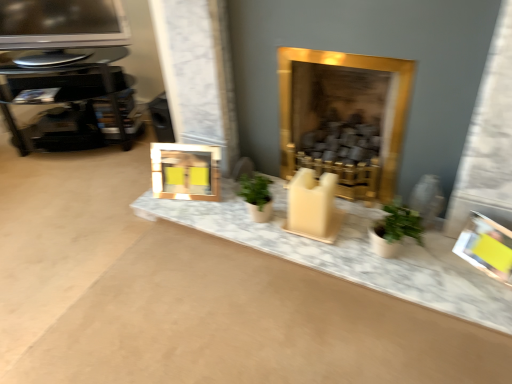
The image size is (512, 384). What do you see at coordinates (350, 253) in the screenshot? I see `marble counter top at center` at bounding box center [350, 253].

You are a GUI agent. You are given a task and a screenshot of the screen. Output one action in this format:
    pyautogui.click(x=<x>, y=<y>)
    Task: Click on the metallic glossy television at upper left
    
    Given the screenshot: What is the action you would take?
    pyautogui.click(x=60, y=28)

Describe the element at coordinates (71, 99) in the screenshot. The width and height of the screenshot is (512, 384). I see `black glass table at left` at that location.

How much space does gold metallic picture frame at center, marked as the first picture frame in a back-to-front arrangement, occupy horizontally?

7.40 inches.

This screenshot has width=512, height=384. What do you see at coordinates (185, 171) in the screenshot?
I see `gold metallic picture frame at center, marked as the first picture frame in a back-to-front arrangement` at bounding box center [185, 171].

You are a GUI agent. You are given a task and a screenshot of the screen. Output one action in this format:
    pyautogui.click(x=<x>, y=<y>)
    Task: Click on the marble counter top at center
    This screenshot has height=384, width=512.
    Given the screenshot: What is the action you would take?
    pyautogui.click(x=350, y=253)

Is marble counter top at center not inside gold metallic fireplace at center?

Yes, marble counter top at center is outside of gold metallic fireplace at center.

In terms of width, does marble counter top at center look wider or thinner when compared to gold metallic fireplace at center?

marble counter top at center is wider than gold metallic fireplace at center.

Where is `counter top that is under the gold metallic fireplace at center (from a real-world perspective)`? Image resolution: width=512 pixels, height=384 pixels. counter top that is under the gold metallic fireplace at center (from a real-world perspective) is located at coordinates (350, 253).

Do you think metallic glossy television at upper left is within gold metallic fireplace at center, or outside of it?

metallic glossy television at upper left is not enclosed by gold metallic fireplace at center.

Between metallic glossy television at upper left and gold metallic fireplace at center, which one appears on the right side from the viewer's perspective?

From the viewer's perspective, gold metallic fireplace at center appears more on the right side.

Considering the positions of point (108, 22) and point (293, 139), is point (108, 22) closer or farther from the camera than point (293, 139)?

Point (108, 22) is positioned farther from the camera compared to point (293, 139).

This screenshot has height=384, width=512. I want to click on picture frame on the right of gold metallic picture frame at center, marked as the first picture frame in a back-to-front arrangement, so click(486, 247).

Based on the photo, from the image's perspective, is gold metallic picture frame at center, acting as the second picture frame starting from the bottom, located above or below yellow paper picture frame at right, arranged as the 2th picture frame when viewed from the top?

gold metallic picture frame at center, acting as the second picture frame starting from the bottom, is above yellow paper picture frame at right, arranged as the 2th picture frame when viewed from the top.

Looking at this image, from a real-world perspective, is gold metallic picture frame at center, acting as the second picture frame starting from the bottom, physically located above or below yellow paper picture frame at right, positioned as the first picture frame in bottom-to-top order?

In terms of real-world spatial position, gold metallic picture frame at center, acting as the second picture frame starting from the bottom, is above yellow paper picture frame at right, positioned as the first picture frame in bottom-to-top order.

Based on their positions, is gold metallic picture frame at center, positioned as the second picture frame in front-to-back order, located to the left or right of yellow paper picture frame at right, arranged as the 2th picture frame when viewed from the top?

In the image, gold metallic picture frame at center, positioned as the second picture frame in front-to-back order, appears on the left side of yellow paper picture frame at right, arranged as the 2th picture frame when viewed from the top.

From the image's perspective, is gold metallic picture frame at center, acting as the second picture frame starting from the bottom, on black glass table at left?

No, from the image's perspective, gold metallic picture frame at center, acting as the second picture frame starting from the bottom, is not on top of black glass table at left.

Is gold metallic picture frame at center, acting as the second picture frame starting from the bottom, in contact with black glass table at left?

No, gold metallic picture frame at center, acting as the second picture frame starting from the bottom, is not making contact with black glass table at left.

From a real-world perspective, which is physically above, gold metallic picture frame at center, positioned as the second picture frame in front-to-back order, or black glass table at left?

In real-world perspective, black glass table at left is above.

Does point (197, 146) lie in front of point (217, 221)?

No, it is behind (217, 221).

Measure the distance between gold metallic picture frame at center, the first picture frame from the top, and marble counter top at center.

gold metallic picture frame at center, the first picture frame from the top, and marble counter top at center are 11.89 inches apart from each other.

At what (x,y) coordinates should I click in order to perform the action: click on counter top on the right of the gold metallic picture frame at center, positioned as the second picture frame in front-to-back order. Please return your answer as a coordinate pair (x, y). This screenshot has height=384, width=512. Looking at the image, I should click on (350, 253).

Considering the sizes of gold metallic picture frame at center, which is counted as the 1th picture frame, starting from the left, and marble counter top at center in the image, is gold metallic picture frame at center, which is counted as the 1th picture frame, starting from the left, bigger or smaller than marble counter top at center?

Clearly, gold metallic picture frame at center, which is counted as the 1th picture frame, starting from the left, is smaller in size than marble counter top at center.

From the picture: Measure the distance from black glass table at left to gold metallic picture frame at center, marked as the first picture frame in a back-to-front arrangement.

The distance of black glass table at left from gold metallic picture frame at center, marked as the first picture frame in a back-to-front arrangement, is 29.19 inches.

Consider the image. Is gold metallic picture frame at center, which is the second picture frame in right-to-left order, completely or partially inside black glass table at left?

No, gold metallic picture frame at center, which is the second picture frame in right-to-left order, is not inside black glass table at left.

Does black glass table at left appear on the left side of gold metallic picture frame at center, which is the second picture frame in right-to-left order?

Correct, you'll find black glass table at left to the left of gold metallic picture frame at center, which is the second picture frame in right-to-left order.

Is yellow paper picture frame at right, which is the second picture frame in left-to-right order, facing away from black glass table at left?

No, black glass table at left is not at the back of yellow paper picture frame at right, which is the second picture frame in left-to-right order.

Is yellow paper picture frame at right, which is the first picture frame in right-to-left order, situated inside black glass table at left or outside?

yellow paper picture frame at right, which is the first picture frame in right-to-left order, exists outside the volume of black glass table at left.

The image size is (512, 384). In order to click on counter top below the gold metallic fireplace at center (from the image's perspective) in this screenshot , I will do `click(350, 253)`.

Find the location of a particular element. fireplace that appears below the metallic glossy television at upper left (from a real-world perspective) is located at coordinates (344, 118).

When comparing their distances from metallic glossy television at upper left, does yellow paper picture frame at right, the second picture frame when ordered from back to front, or marble counter top at center seem closer?

Based on the image, marble counter top at center appears to be nearer to metallic glossy television at upper left.

Looking at the image, which one is located further to gold metallic picture frame at center, positioned as the second picture frame in front-to-back order, yellow paper picture frame at right, positioned as the first picture frame in bottom-to-top order, or gold metallic fireplace at center?

Among the two, yellow paper picture frame at right, positioned as the first picture frame in bottom-to-top order, is located further to gold metallic picture frame at center, positioned as the second picture frame in front-to-back order.

In the scene shown: Based on their spatial positions, is gold metallic fireplace at center or yellow paper picture frame at right, which is the second picture frame in left-to-right order, closer to gold metallic picture frame at center, positioned as the second picture frame in front-to-back order?

The object closer to gold metallic picture frame at center, positioned as the second picture frame in front-to-back order, is gold metallic fireplace at center.

Considering their positions, is marble counter top at center positioned further to metallic glossy television at upper left than gold metallic fireplace at center?

gold metallic fireplace at center is positioned further to the anchor metallic glossy television at upper left.

Which object lies nearer to the anchor point gold metallic picture frame at center, marked as the first picture frame in a back-to-front arrangement, yellow paper picture frame at right, which is the first picture frame in right-to-left order, or metallic glossy television at upper left?

metallic glossy television at upper left is closer to gold metallic picture frame at center, marked as the first picture frame in a back-to-front arrangement.

Which object lies nearer to the anchor point gold metallic fireplace at center, yellow paper picture frame at right, arranged as the 2th picture frame when viewed from the top, or black glass table at left?

Among the two, yellow paper picture frame at right, arranged as the 2th picture frame when viewed from the top, is located nearer to gold metallic fireplace at center.

Estimate the real-world distances between objects in this image. Which object is further from metallic glossy television at upper left, yellow paper picture frame at right, which is the second picture frame in left-to-right order, or black glass table at left?

The object further to metallic glossy television at upper left is yellow paper picture frame at right, which is the second picture frame in left-to-right order.

From the picture: When comparing their distances from marble counter top at center, does yellow paper picture frame at right, positioned as the first picture frame in bottom-to-top order, or gold metallic picture frame at center, the first picture frame from the top, seem further?

yellow paper picture frame at right, positioned as the first picture frame in bottom-to-top order, lies further to marble counter top at center than the other object.

In order to click on picture frame situated between black glass table at left and yellow paper picture frame at right, which is counted as the first picture frame, starting from the front, from left to right in this screenshot , I will do `click(185, 171)`.

This screenshot has height=384, width=512. In order to click on counter top situated between black glass table at left and gold metallic fireplace at center from left to right in this screenshot , I will do point(350,253).

Identify the location of fireplace between metallic glossy television at upper left and yellow paper picture frame at right, arranged as the 2th picture frame when viewed from the top, in the horizontal direction. (344, 118).

In order to click on television situated between black glass table at left and gold metallic picture frame at center, which is the second picture frame in right-to-left order, from left to right in this screenshot , I will do `click(60, 28)`.